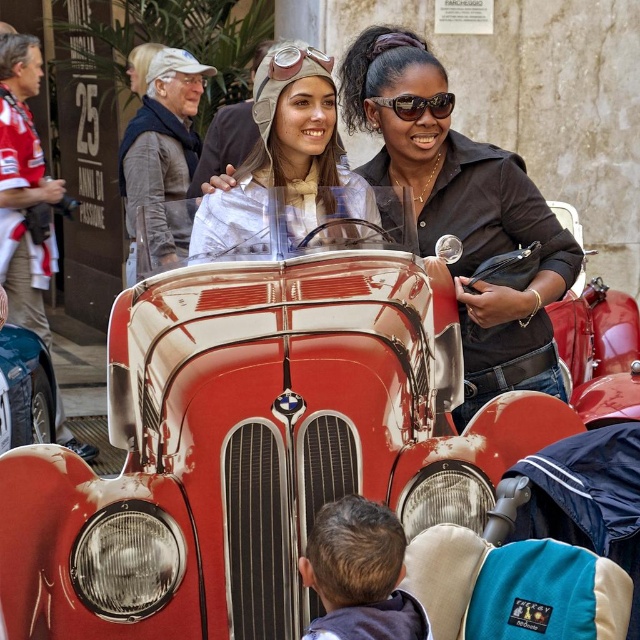
Is black leather jacket at center bigger than metallic silver helmet at center?

Indeed, black leather jacket at center has a larger size compared to metallic silver helmet at center.

The height and width of the screenshot is (640, 640). Describe the element at coordinates (465, 216) in the screenshot. I see `black leather jacket at center` at that location.

Does point (540, 380) lie in front of point (289, 92)?

No.

Locate an element on the screen. black leather jacket at center is located at coordinates (465, 216).

Is point (228, 166) closer to viewer compared to point (422, 109)?

Yes, point (228, 166) is in front of point (422, 109).

Can you confirm if metallic silver helmet at center is positioned above shiny silver aviator goggles at upper center?

Actually, metallic silver helmet at center is below shiny silver aviator goggles at upper center.

Is point (294, 184) farther from camera compared to point (413, 113)?

Yes.

Locate an element on the screen. metallic silver helmet at center is located at coordinates (282, 163).

Which is behind, point (538, 221) or point (401, 102)?

Positioned behind is point (538, 221).

Is point (406, 150) less distant than point (404, 104)?

No.

Is point (550, 275) positioned after point (397, 115)?

That is False.

The image size is (640, 640). Find the location of `black leather jacket at center`. black leather jacket at center is located at coordinates click(465, 216).